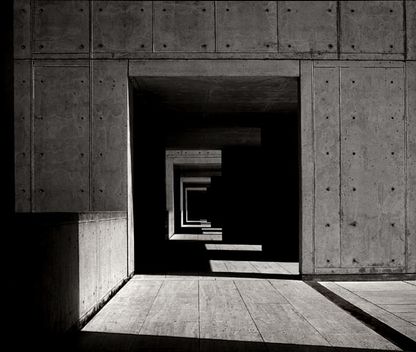
What are the coordinates of `grey wall` in the screenshot? It's located at pos(224,45).